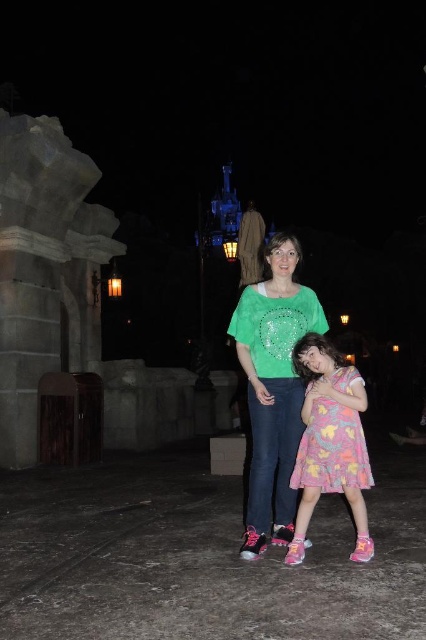
You are a photographer standing 5 meters away from both the green glittery blouse at center and the pastel floral dress at center. Can you fit both subjects in your camera frame if your camera has a minimum distance of 3 meters and a maximum distance of 5 meters?

The green glittery blouse at center and the pastel floral dress at center are 3.37 meters apart. Since the minimum distance your camera can focus is 3 meters, the subjects are within the required range. Therefore, you can fit both subjects in your camera frame.

You are a photographer trying to capture a clear photo of both the green glittery blouse at center and the pastel floral dress at center. Which one is closer to the camera?

The green glittery blouse at center is closer to the camera because the pastel floral dress at center is behind it.

In the scene shown: You are a photographer taking a picture of two people wearing the green glittery blouse at center and the pastel floral dress at center. Which one is positioned to the left side of the other?

The green glittery blouse at center is positioned to the left of the pastel floral dress at center.